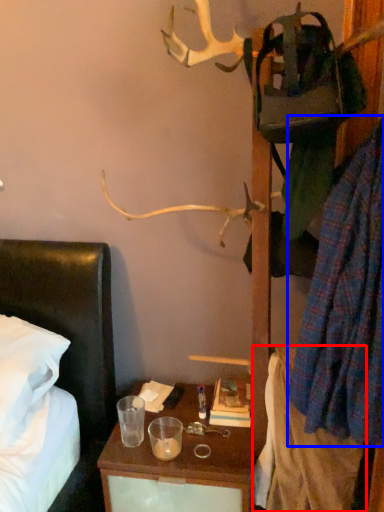
Question: Which of the following is the closest to the observer, clothing (highlighted by a red box) or clothing (highlighted by a blue box)?

Choices:
 (A) clothing
 (B) clothing

Answer: (B)